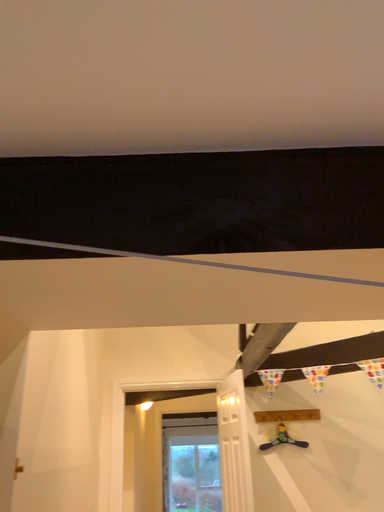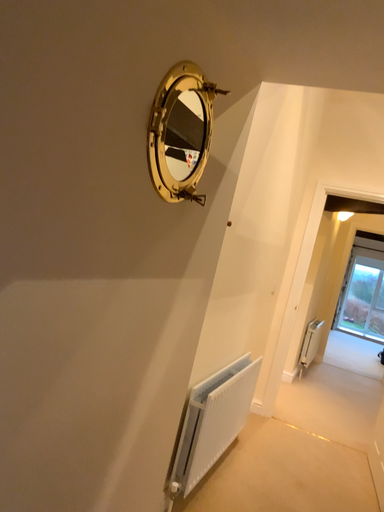
Question: How did the camera likely rotate when shooting the video?

Choices:
 (A) rotated left
 (B) rotated right

Answer: (A)